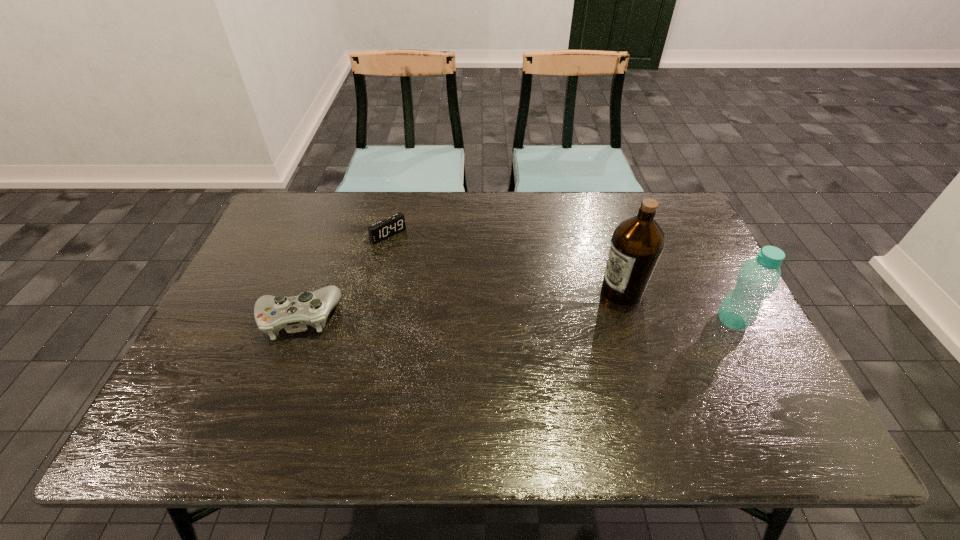
You are a GUI agent. You are given a task and a screenshot of the screen. Output one action in this format:
    pyautogui.click(x=<x>, y=<y>)
    Task: Click on the vacant space that satisfies the following two spatial constraints: 1. on the front side of the shortest object; 2. on the right side of the tallest object
    
    Given the screenshot: What is the action you would take?
    pyautogui.click(x=375, y=291)

Locate an element on the screen. The height and width of the screenshot is (540, 960). free space in the image that satisfies the following two spatial constraints: 1. on the front side of the shortest object; 2. on the left side of the tallest object is located at coordinates (375, 291).